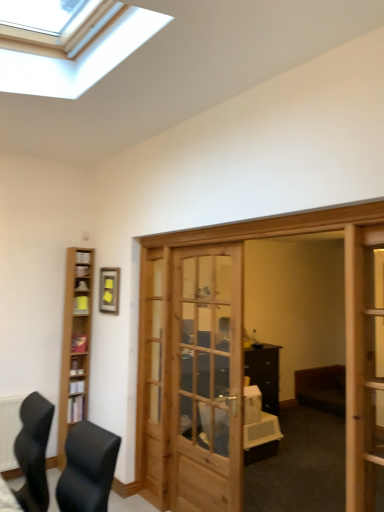
Question: Considering the relative positions of yellow paper at left, the 2th shelf positioned from the front, and light brown wood bookshelf at left in the image provided, is yellow paper at left, the 2th shelf positioned from the front, to the right of light brown wood bookshelf at left from the viewer's perspective?

Choices:
 (A) yes
 (B) no

Answer: (A)

Question: Is light brown wood bookshelf at left surrounded by yellow paper at left, placed as the first shelf when sorted from top to bottom?

Choices:
 (A) yes
 (B) no

Answer: (B)

Question: Does yellow paper at left, which ranks as the 2th shelf in bottom-to-top order, turn towards light brown wood bookshelf at left?

Choices:
 (A) no
 (B) yes

Answer: (B)

Question: Can you confirm if yellow paper at left, the 2th shelf positioned from the front, is wider than light brown wood bookshelf at left?

Choices:
 (A) no
 (B) yes

Answer: (A)

Question: From a real-world perspective, does yellow paper at left, which is counted as the 1th shelf, starting from the back, sit lower than light brown wood bookshelf at left?

Choices:
 (A) no
 (B) yes

Answer: (A)

Question: Considering the positions of wooden screen door at right and yellow matte picture frame at upper left in the image, is wooden screen door at right taller or shorter than yellow matte picture frame at upper left?

Choices:
 (A) short
 (B) tall

Answer: (B)

Question: Based on their sizes in the image, would you say wooden screen door at right is bigger or smaller than yellow matte picture frame at upper left?

Choices:
 (A) big
 (B) small

Answer: (A)

Question: In the image, is wooden screen door at right on the left side or the right side of yellow matte picture frame at upper left?

Choices:
 (A) right
 (B) left

Answer: (A)

Question: From a real-world perspective, relative to yellow matte picture frame at upper left, is wooden screen door at right vertically above or below?

Choices:
 (A) below
 (B) above

Answer: (A)

Question: Do you think wooden bookshelf at lower left, which ranks as the second shelf in back-to-front order, is within yellow paper at left, which is counted as the 1th shelf, starting from the back, or outside of it?

Choices:
 (A) inside
 (B) outside

Answer: (B)

Question: Does point (82, 410) appear closer or farther from the camera than point (84, 311)?

Choices:
 (A) closer
 (B) farther

Answer: (A)

Question: From a real-world perspective, relative to yellow paper at left, the 2th shelf positioned from the front, is wooden bookshelf at lower left, which ranks as the second shelf in back-to-front order, vertically above or below?

Choices:
 (A) below
 (B) above

Answer: (A)

Question: From the image's perspective, is wooden bookshelf at lower left, arranged as the 2th shelf when viewed from the top, above or below yellow paper at left, which ranks as the 2th shelf in bottom-to-top order?

Choices:
 (A) above
 (B) below

Answer: (B)

Question: Considering the positions of light brown wood bookshelf at left and yellow paper at left, the 2th shelf positioned from the front, in the image, is light brown wood bookshelf at left bigger or smaller than yellow paper at left, the 2th shelf positioned from the front,?

Choices:
 (A) small
 (B) big

Answer: (B)

Question: Considering the positions of light brown wood bookshelf at left and yellow paper at left, which is counted as the 1th shelf, starting from the back, in the image, is light brown wood bookshelf at left wider or thinner than yellow paper at left, which is counted as the 1th shelf, starting from the back,?

Choices:
 (A) thin
 (B) wide

Answer: (B)